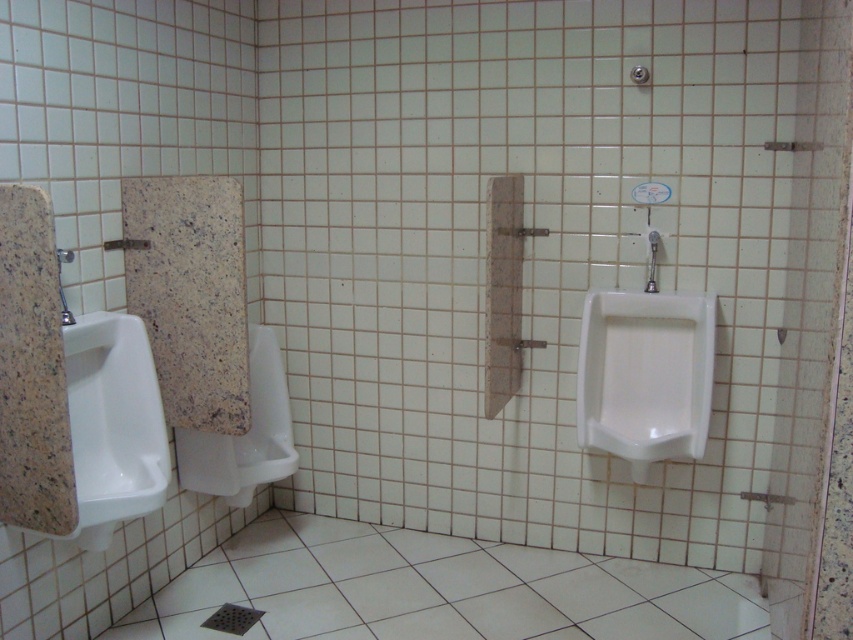
Which is more to the right, white glossy urinal at right or white glossy urinal at left?

white glossy urinal at right is more to the right.

Does white glossy urinal at right have a larger size compared to white glossy urinal at left?

Incorrect, white glossy urinal at right is not larger than white glossy urinal at left.

Locate an element on the screen. The height and width of the screenshot is (640, 853). white glossy urinal at right is located at coordinates (645, 376).

Does white glossy urinal at right appear under white glossy urinal at center?

No.

Locate an element on the screen. This screenshot has height=640, width=853. white glossy urinal at right is located at coordinates (645, 376).

The height and width of the screenshot is (640, 853). Describe the element at coordinates (645, 376) in the screenshot. I see `white glossy urinal at right` at that location.

Identify the location of white glossy urinal at right. This screenshot has width=853, height=640. (645, 376).

Can you confirm if white glossy urinal at left is bigger than white glossy urinal at center?

Incorrect, white glossy urinal at left is not larger than white glossy urinal at center.

Between white glossy urinal at left and white glossy urinal at center, which one has more height?

white glossy urinal at left is taller.

What do you see at coordinates (113, 424) in the screenshot? The height and width of the screenshot is (640, 853). I see `white glossy urinal at left` at bounding box center [113, 424].

This screenshot has height=640, width=853. I want to click on white glossy urinal at left, so point(113,424).